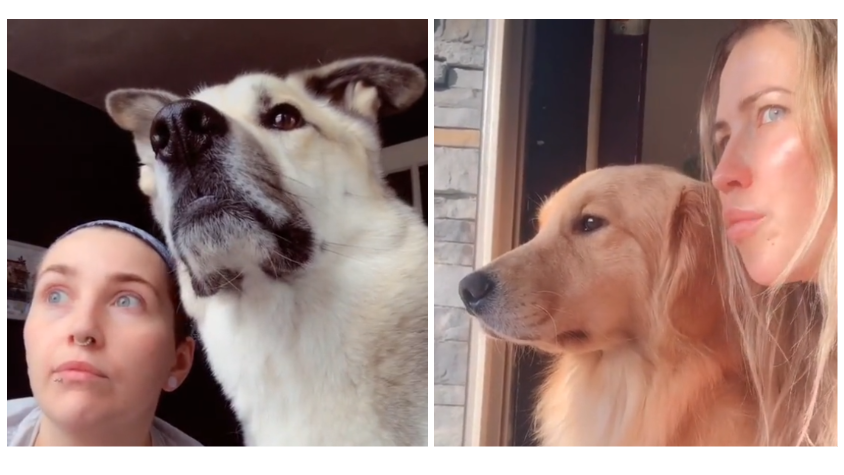
Locate an element on the screen. wall is located at coordinates (658, 120), (62, 164).